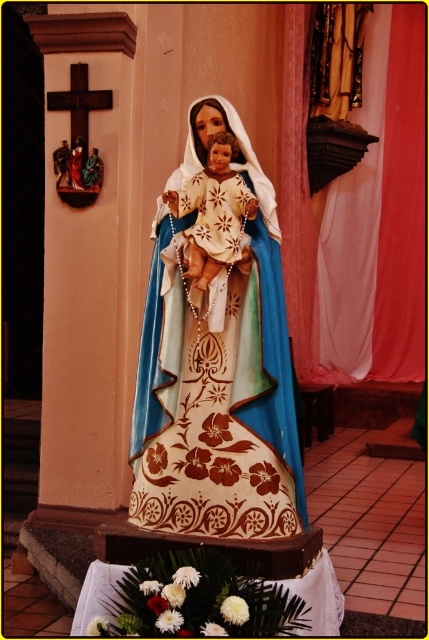
Does point (157, 289) lie behind point (56, 152)?

No, (157, 289) is closer to viewer.

Is painted wood statue at center positioned before wooden statue at center?

Yes, painted wood statue at center is in front of wooden statue at center.

Between point (217, 208) and point (66, 156), which one is positioned behind?

The point (66, 156) is behind.

Where is `painted wood statue at center`? painted wood statue at center is located at coordinates (217, 356).

Can you confirm if painted wood statue at center is taller than wooden statue at left?

Correct, painted wood statue at center is much taller as wooden statue at left.

Who is shorter, painted wood statue at center or wooden statue at left?

wooden statue at left is shorter.

Find the location of a particular element. painted wood statue at center is located at coordinates (217, 356).

Is matte painted wood doll at center wider than wooden statue at left?

Correct, the width of matte painted wood doll at center exceeds that of wooden statue at left.

Where is `matte painted wood doll at center`? matte painted wood doll at center is located at coordinates (214, 212).

Describe the element at coordinates (214, 212) in the screenshot. The height and width of the screenshot is (640, 429). I see `matte painted wood doll at center` at that location.

Where is `matte painted wood doll at center`? matte painted wood doll at center is located at coordinates (x=214, y=212).